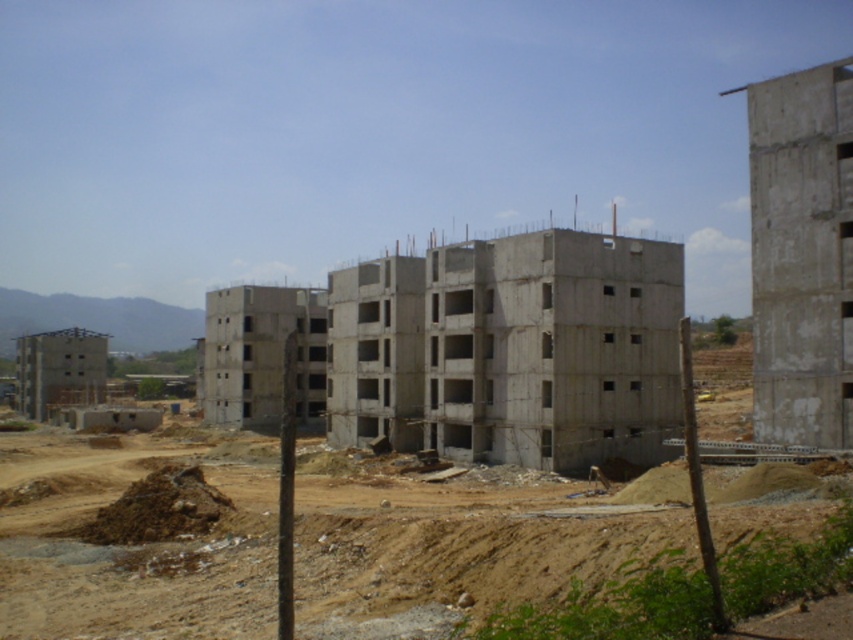
Who is lower down, brown sandy dirt field at center or concrete building at center?

brown sandy dirt field at center is lower down.

Which is in front, point (125, 595) or point (621, 413)?

Point (125, 595)

Identify the location of brown sandy dirt field at center. This screenshot has width=853, height=640. (453, 547).